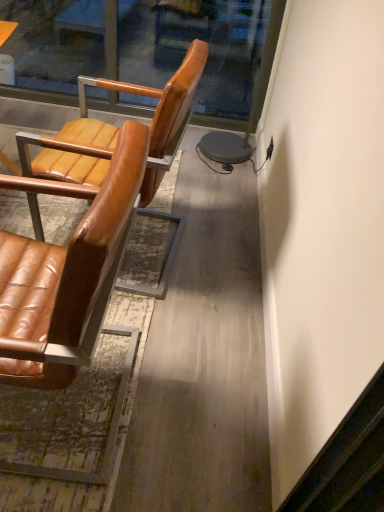
What do you see at coordinates (145, 49) in the screenshot? Image resolution: width=384 pixels, height=512 pixels. I see `transparent glass door at upper center` at bounding box center [145, 49].

The height and width of the screenshot is (512, 384). What do you see at coordinates (65, 275) in the screenshot?
I see `brown leather chair at left, arranged as the 2th chair when viewed from the back` at bounding box center [65, 275].

Image resolution: width=384 pixels, height=512 pixels. In order to click on brown leather chair at left, which appears as the first chair when viewed from the back in this screenshot , I will do `click(116, 142)`.

Which point is more forward, (157, 39) or (97, 207)?

Positioned in front is point (97, 207).

At what (x,y) coordinates should I click in order to perform the action: click on glass door behind the brown leather chair at left, the 1th chair positioned from the front. Please return your answer as a coordinate pair (x, y). Looking at the image, I should click on (145, 49).

Is transparent glass door at upper center looking in the opposite direction of brown leather chair at left, the 1th chair positioned from the front?

No, transparent glass door at upper center's orientation is not away from brown leather chair at left, the 1th chair positioned from the front.

Between transparent glass door at upper center and brown leather chair at left, arranged as the 2th chair when viewed from the back, which one has more height?

With more height is brown leather chair at left, arranged as the 2th chair when viewed from the back.

Is transparent glass door at upper center not close to brown leather chair at left, which appears as the first chair when viewed from the back?

That's right, there is a large distance between transparent glass door at upper center and brown leather chair at left, which appears as the first chair when viewed from the back.

Can you confirm if transparent glass door at upper center is wider than brown leather chair at left, placed as the second chair when sorted from front to back?

No, transparent glass door at upper center is not wider than brown leather chair at left, placed as the second chair when sorted from front to back.

Who is more distant, transparent glass door at upper center or brown leather chair at left, placed as the second chair when sorted from front to back?

transparent glass door at upper center is further away from the camera.

From a real-world perspective, is brown leather chair at left, which appears as the first chair when viewed from the back, below transparent glass door at upper center?

No, from a real-world perspective, brown leather chair at left, which appears as the first chair when viewed from the back, is not beneath transparent glass door at upper center.

From the picture: Can you tell me how much brown leather chair at left, which appears as the first chair when viewed from the back, and transparent glass door at upper center differ in facing direction?

brown leather chair at left, which appears as the first chair when viewed from the back, and transparent glass door at upper center are facing 93.6 degrees away from each other.

Between brown leather chair at left, placed as the second chair when sorted from front to back, and transparent glass door at upper center, which one has larger width?

Wider between the two is brown leather chair at left, placed as the second chair when sorted from front to back.

From the image's perspective, relative to transparent glass door at upper center, is brown leather chair at left, placed as the second chair when sorted from front to back, above or below?

From the image's perspective, brown leather chair at left, placed as the second chair when sorted from front to back, appears below transparent glass door at upper center.

From a real-world perspective, relative to brown leather chair at left, the 1th chair positioned from the front, is brown leather chair at left, which appears as the first chair when viewed from the back, vertically above or below?

brown leather chair at left, which appears as the first chair when viewed from the back, is situated lower than brown leather chair at left, the 1th chair positioned from the front, in the real world.

Which object is positioned more to the right, brown leather chair at left, placed as the second chair when sorted from front to back, or brown leather chair at left, the 1th chair positioned from the front?

brown leather chair at left, placed as the second chair when sorted from front to back.

Image resolution: width=384 pixels, height=512 pixels. Find the location of `chair that is in front of the brown leather chair at left, placed as the second chair when sorted from front to back`. chair that is in front of the brown leather chair at left, placed as the second chair when sorted from front to back is located at coordinates (65, 275).

Which of these two, brown leather chair at left, arranged as the 2th chair when viewed from the back, or transparent glass door at upper center, is wider?

Wider between the two is brown leather chair at left, arranged as the 2th chair when viewed from the back.

Considering the relative positions of brown leather chair at left, the 1th chair positioned from the front, and transparent glass door at upper center in the image provided, is brown leather chair at left, the 1th chair positioned from the front, to the left or to the right of transparent glass door at upper center?

In the image, brown leather chair at left, the 1th chair positioned from the front, appears on the left side of transparent glass door at upper center.

From a real-world perspective, which is physically below, brown leather chair at left, the 1th chair positioned from the front, or transparent glass door at upper center?

transparent glass door at upper center, from a real-world perspective.

From the image's perspective, which is below, brown leather chair at left, the 1th chair positioned from the front, or brown leather chair at left, which appears as the first chair when viewed from the back?

brown leather chair at left, the 1th chair positioned from the front, from the image's perspective.

The width and height of the screenshot is (384, 512). I want to click on chair above the brown leather chair at left, arranged as the 2th chair when viewed from the back (from the image's perspective), so click(116, 142).

Considering the relative sizes of brown leather chair at left, arranged as the 2th chair when viewed from the back, and brown leather chair at left, placed as the second chair when sorted from front to back, in the image provided, is brown leather chair at left, arranged as the 2th chair when viewed from the back, thinner than brown leather chair at left, placed as the second chair when sorted from front to back,?

Yes, brown leather chair at left, arranged as the 2th chair when viewed from the back, is thinner than brown leather chair at left, placed as the second chair when sorted from front to back.

From a real-world perspective, is brown leather chair at left, the 1th chair positioned from the front, located higher than brown leather chair at left, which appears as the first chair when viewed from the back?

Correct, in the physical world, brown leather chair at left, the 1th chair positioned from the front, is higher than brown leather chair at left, which appears as the first chair when viewed from the back.

From the image's perspective, count 2nd chairs downward from the transparent glass door at upper center and point to it. Please provide its 2D coordinates.

[(65, 275)]

Find the location of a particular element. chair located on the right of transparent glass door at upper center is located at coordinates (116, 142).

Looking at the image, which one is located closer to brown leather chair at left, the 1th chair positioned from the front, transparent glass door at upper center or brown leather chair at left, which appears as the first chair when viewed from the back?

brown leather chair at left, which appears as the first chair when viewed from the back, is positioned closer to the anchor brown leather chair at left, the 1th chair positioned from the front.

Looking at the image, which one is located further to brown leather chair at left, which appears as the first chair when viewed from the back, brown leather chair at left, arranged as the 2th chair when viewed from the back, or transparent glass door at upper center?

Based on the image, transparent glass door at upper center appears to be further to brown leather chair at left, which appears as the first chair when viewed from the back.

From the image, which object appears to be nearer to transparent glass door at upper center, brown leather chair at left, placed as the second chair when sorted from front to back, or brown leather chair at left, arranged as the 2th chair when viewed from the back?

The object closer to transparent glass door at upper center is brown leather chair at left, placed as the second chair when sorted from front to back.

Looking at this image, considering their positions, is transparent glass door at upper center positioned further to brown leather chair at left, which appears as the first chair when viewed from the back, than brown leather chair at left, arranged as the 2th chair when viewed from the back?

Among the two, transparent glass door at upper center is located further to brown leather chair at left, which appears as the first chair when viewed from the back.

When comparing their distances from transparent glass door at upper center, does brown leather chair at left, the 1th chair positioned from the front, or brown leather chair at left, placed as the second chair when sorted from front to back, seem closer?

brown leather chair at left, placed as the second chair when sorted from front to back, is closer to transparent glass door at upper center.

Estimate the real-world distances between objects in this image. Which object is closer to brown leather chair at left, the 1th chair positioned from the front, brown leather chair at left, which appears as the first chair when viewed from the back, or transparent glass door at upper center?

brown leather chair at left, which appears as the first chair when viewed from the back.

Identify the location of chair between brown leather chair at left, the 1th chair positioned from the front, and transparent glass door at upper center in the front-back direction. (116, 142).